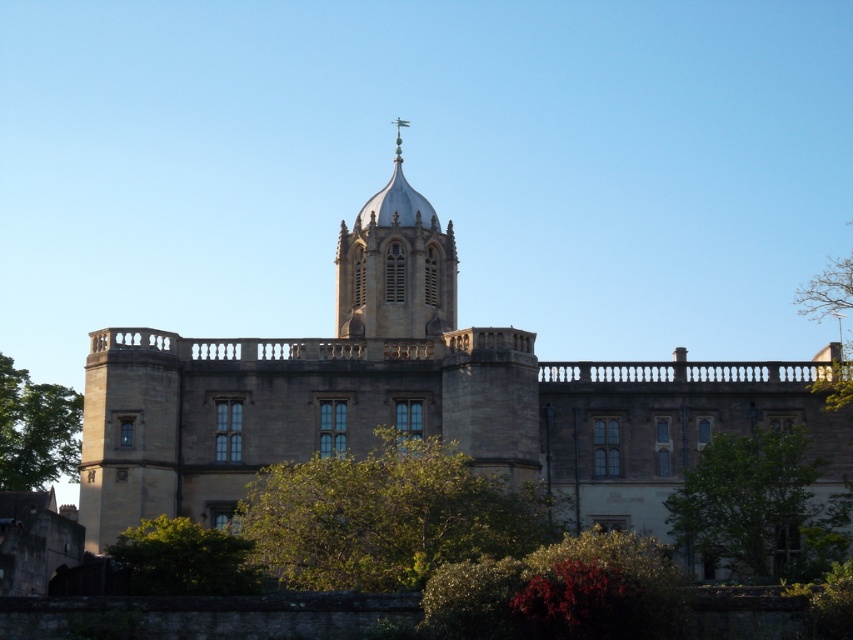
Question: In this image, where is green leafy tree at center located relative to green leafy tree at upper right?

Choices:
 (A) below
 (B) above

Answer: (A)

Question: Which of the following is the closest to the observer?

Choices:
 (A) tap(134, 564)
 (B) tap(457, 531)
 (C) tap(360, 211)
 (D) tap(833, 301)

Answer: (A)

Question: Considering the relative positions of green leafy tree at lower right and green leafy tree at lower left in the image provided, where is green leafy tree at lower right located with respect to green leafy tree at lower left?

Choices:
 (A) above
 (B) below

Answer: (B)

Question: Which of the following is the farthest from the observer?

Choices:
 (A) green leafy tree at lower right
 (B) silver metallic spire at center

Answer: (B)

Question: Can you confirm if green leafy tree at lower right is wider than silver metallic spire at center?

Choices:
 (A) no
 (B) yes

Answer: (B)

Question: Which is nearer to the green leafy tree at lower left?

Choices:
 (A) brown stone church at center
 (B) green leafy bush at lower left

Answer: (A)